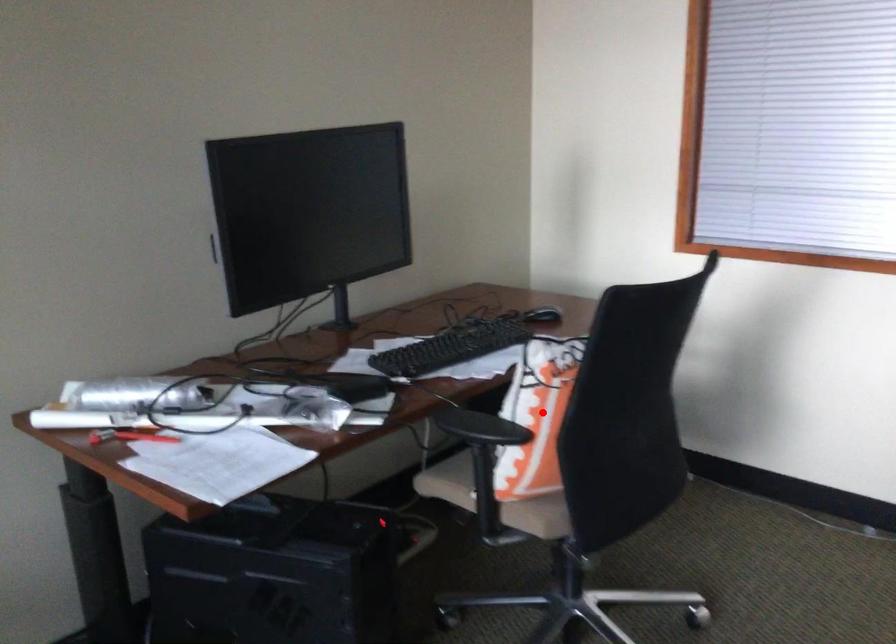
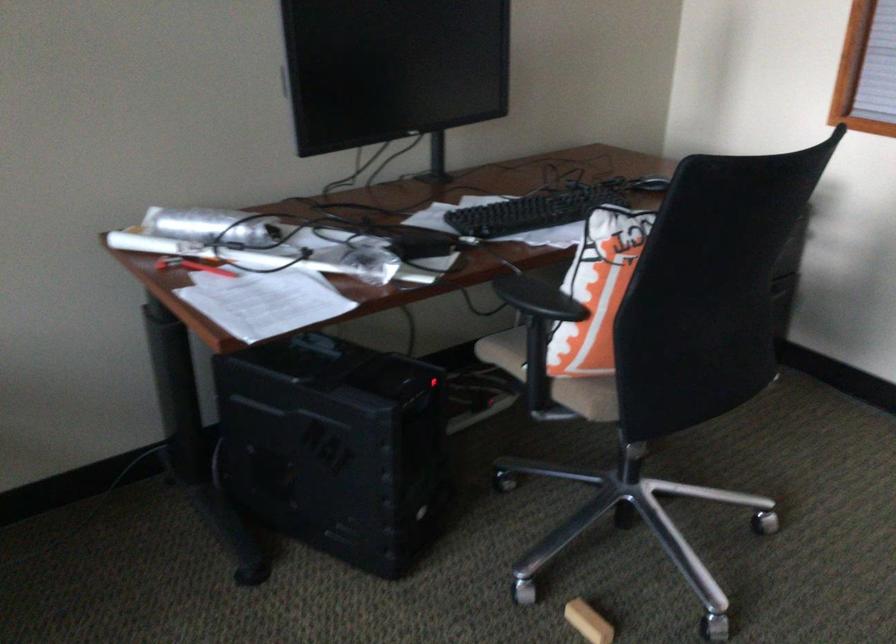
Find the pixel in the second image that matches the highlighted location in the first image.

(597, 290)